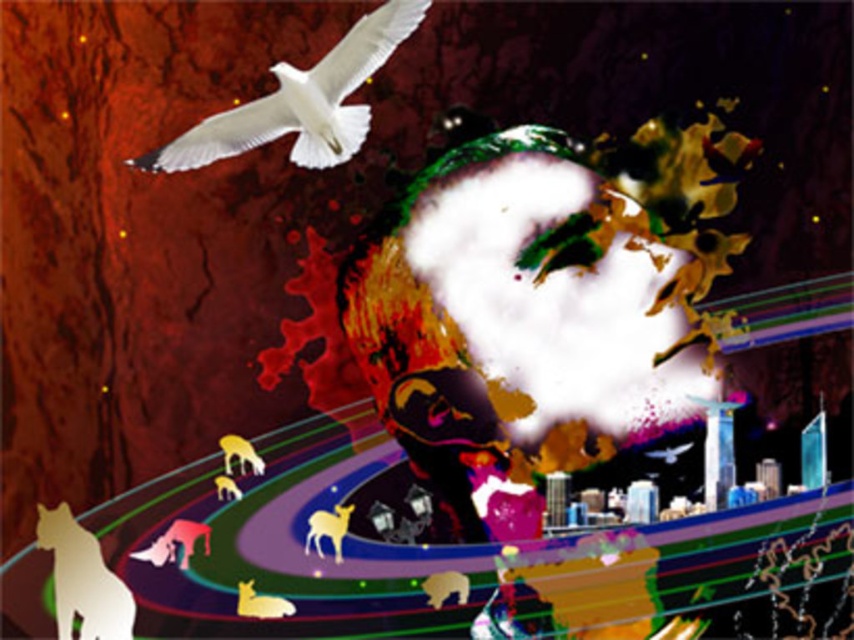
Is shiny gold deer at center positioned behind shiny gold deer at lower left?

No.

Can you confirm if shiny gold deer at center is positioned to the left of shiny gold deer at lower left?

A: In fact, shiny gold deer at center is to the right of shiny gold deer at lower left.

Find the location of a particular element. shiny gold deer at center is located at coordinates (328, 529).

You are a GUI agent. You are given a task and a screenshot of the screen. Output one action in this format:
    pyautogui.click(x=<x>, y=<y>)
    Task: Click on the silhouette fur at lower left
    This screenshot has width=854, height=640.
    Given the screenshot: What is the action you would take?
    pyautogui.click(x=83, y=579)

Which is below, silhouette fur at lower left or shiny gold deer at lower left?

silhouette fur at lower left is below.

Is point (80, 625) positioned before point (226, 483)?

Yes.

The width and height of the screenshot is (854, 640). What are the coordinates of `silhouette fur at lower left` in the screenshot? It's located at (83, 579).

Is white glossy bird at upper left further to camera compared to shiny gold deer at center?

That is False.

Which is behind, point (282, 113) or point (326, 518)?

The point (326, 518) is behind.

Between point (387, 28) and point (323, 524), which one is positioned in front?

Point (387, 28) is more forward.

You are a GUI agent. You are given a task and a screenshot of the screen. Output one action in this format:
    pyautogui.click(x=<x>, y=<y>)
    Task: Click on the white glossy bird at upper left
    This screenshot has height=640, width=854.
    Given the screenshot: What is the action you would take?
    pyautogui.click(x=300, y=102)